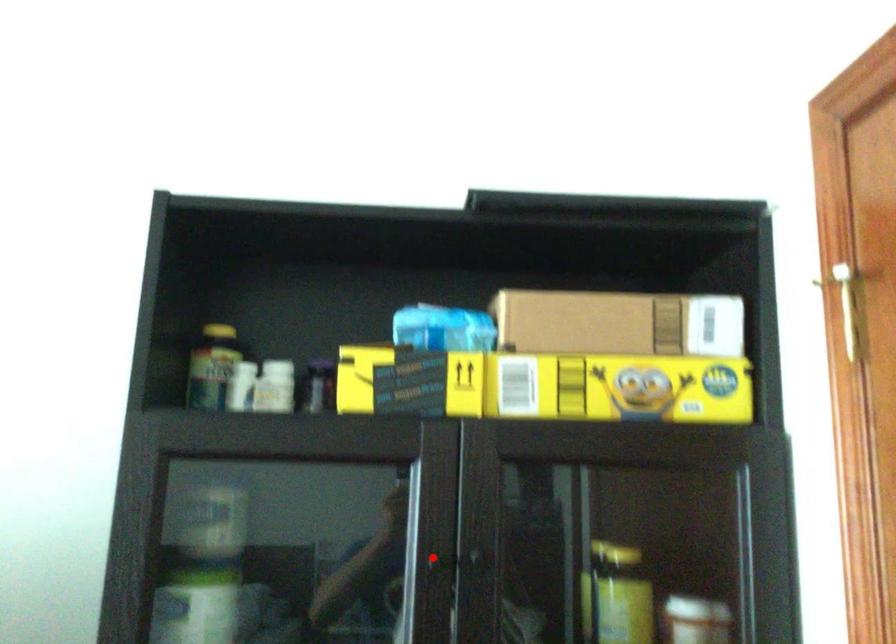
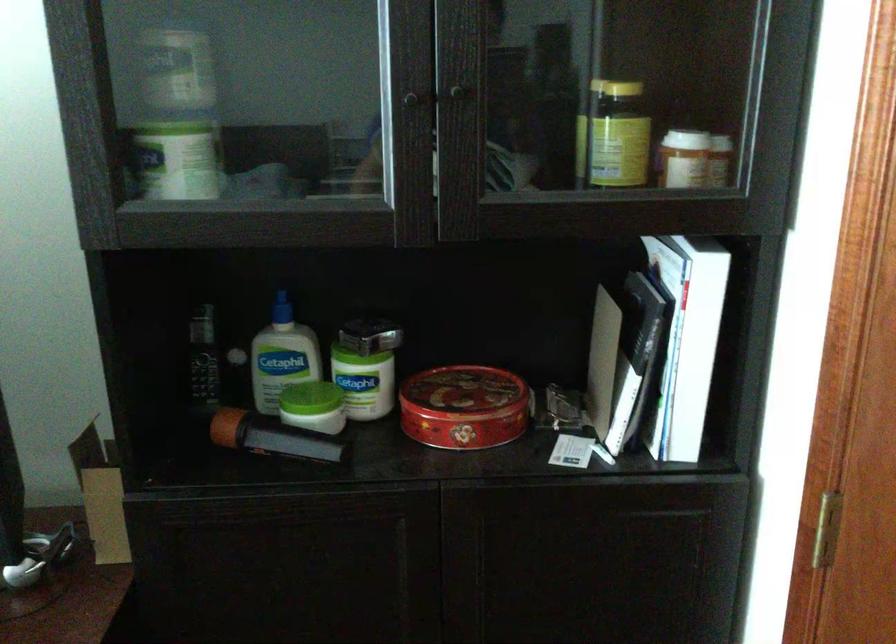
Find the pixel in the second image that matches the highlighted location in the first image.

(409, 93)